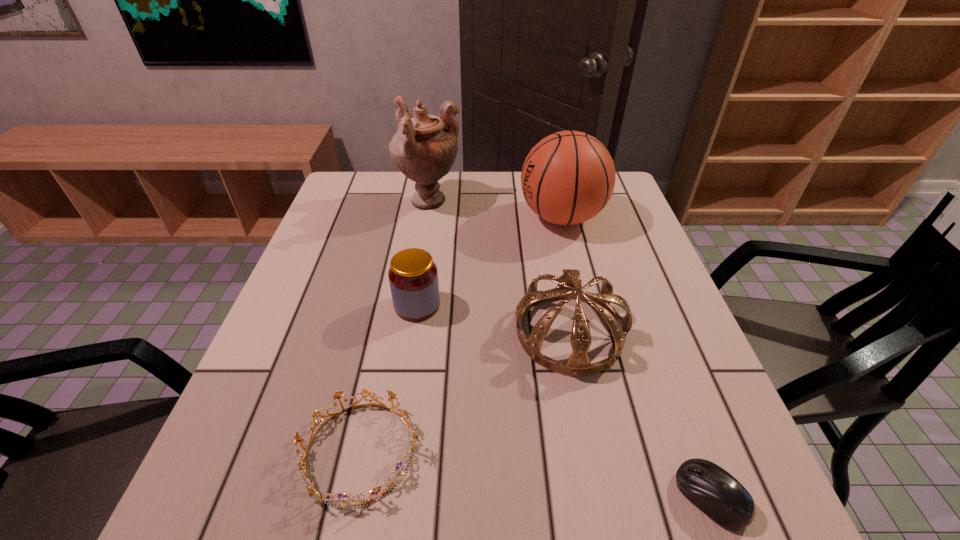
The image size is (960, 540). Find the location of `free location at the right edge of the desktop`. free location at the right edge of the desktop is located at coordinates (640, 363).

What are the coordinates of `vacant space at the far left corner of the desktop` in the screenshot? It's located at (367, 194).

Find the location of a particular element. The width and height of the screenshot is (960, 540). free area in between the third shortest object and the shortest object is located at coordinates (564, 401).

Where is `empty location between the left tiara and the shortest object`? This screenshot has width=960, height=540. empty location between the left tiara and the shortest object is located at coordinates (535, 474).

This screenshot has width=960, height=540. In order to click on unoccupied area between the shortest object and the tallest object in this screenshot , I will do `click(569, 349)`.

The width and height of the screenshot is (960, 540). In order to click on empty location between the jar and the farther tiara in this screenshot , I will do `click(493, 319)`.

Identify the location of vacant space that's between the shortest object and the second shortest object. (535, 474).

You are a GUI agent. You are given a task and a screenshot of the screen. Output one action in this format:
    pyautogui.click(x=<x>, y=<y>)
    Task: Click on the vacant space in between the third shortest object and the shorter tiara
    This screenshot has height=540, width=960.
    Given the screenshot: What is the action you would take?
    pyautogui.click(x=389, y=379)

Where is `empty location between the nearer tiara and the basketball`? The image size is (960, 540). empty location between the nearer tiara and the basketball is located at coordinates (461, 334).

Locate an element on the screen. Image resolution: width=960 pixels, height=540 pixels. free space between the basketball and the urn is located at coordinates (495, 210).